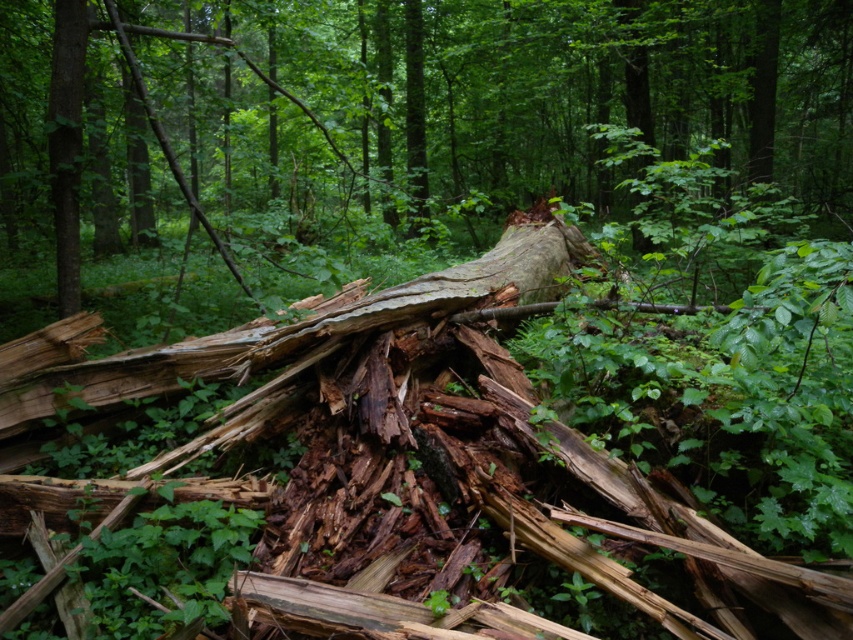
Question: In this image, where is rough bark log at center located relative to smooth brown tree trunk at left?

Choices:
 (A) above
 (B) below

Answer: (A)

Question: Can you confirm if rough bark log at center is positioned to the right of smooth brown tree trunk at left?

Choices:
 (A) no
 (B) yes

Answer: (B)

Question: Does rough bark log at center have a lesser width compared to smooth brown tree trunk at left?

Choices:
 (A) no
 (B) yes

Answer: (A)

Question: Among these objects, which one is farthest from the camera?

Choices:
 (A) smooth brown tree trunk at left
 (B) rough bark log at center

Answer: (A)

Question: Which point is closer to the camera taking this photo?

Choices:
 (A) (71, 200)
 (B) (798, 8)

Answer: (A)